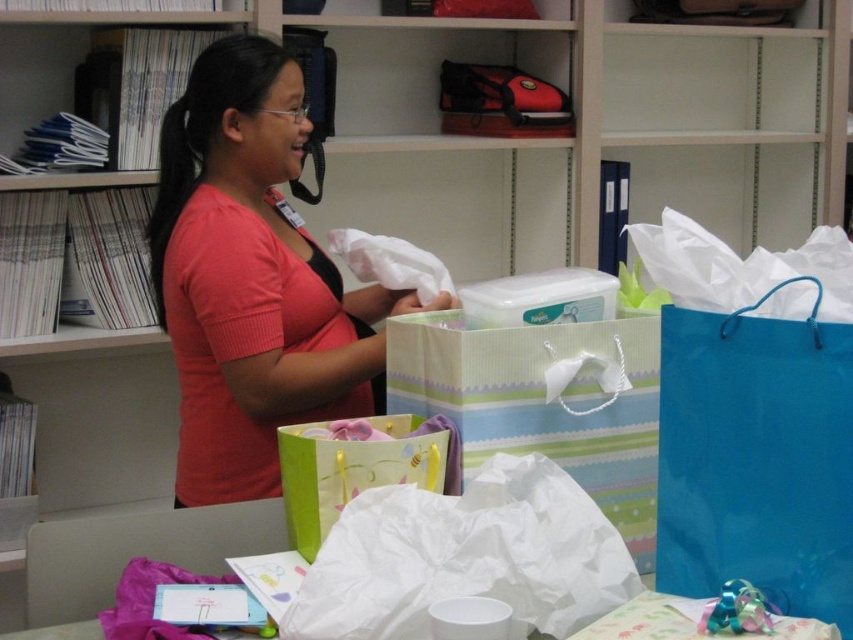
You are standing at the table in the library scene. There are two points marked on the table. The first point is at coordinate [724,440] and the second point is at [428,432]. Which point is closer to you as you face the table?

Point [724,440] is in front of point [428,432], so the first point is closer to you as you face the table.

What are the coordinates of the pink matte shirt at center?

The pink matte shirt at center is located at coordinates point [252,278].